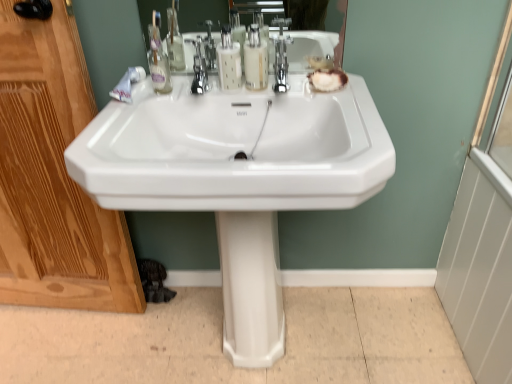
This screenshot has height=384, width=512. What are the coordinates of `free space to the left of translucent plastic soap dispenser at center, marked as the first soap dispenser in a left-to-right arrangement` in the screenshot? It's located at (173, 93).